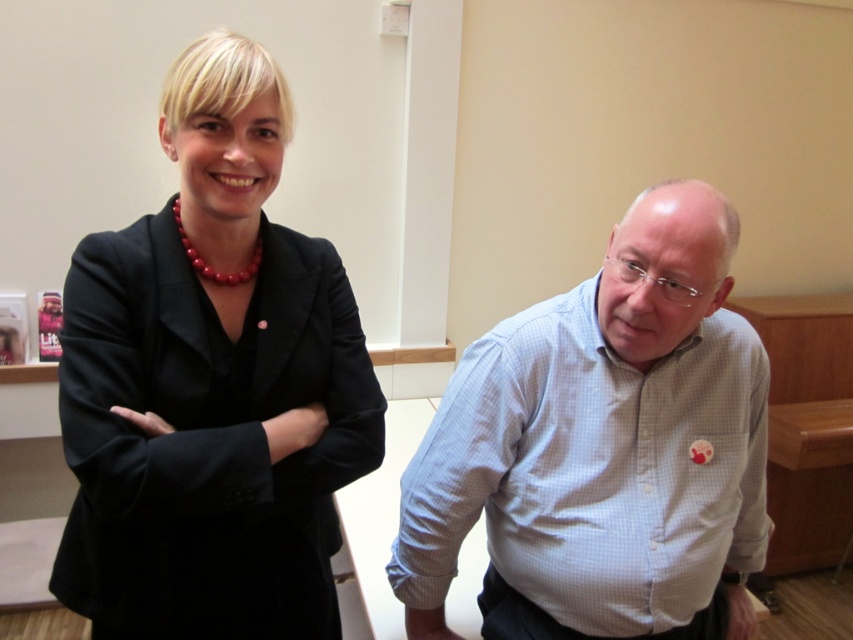
Does black matte blazer at upper left have a larger size compared to white checkered shirt at right?

Correct, black matte blazer at upper left is larger in size than white checkered shirt at right.

Is black matte blazer at upper left to the left of white checkered shirt at right from the viewer's perspective?

Indeed, black matte blazer at upper left is positioned on the left side of white checkered shirt at right.

Describe the element at coordinates (212, 385) in the screenshot. I see `black matte blazer at upper left` at that location.

You are a GUI agent. You are given a task and a screenshot of the screen. Output one action in this format:
    pyautogui.click(x=<x>, y=<y>)
    Task: Click on the black matte blazer at upper left
    This screenshot has width=853, height=640.
    Given the screenshot: What is the action you would take?
    pyautogui.click(x=212, y=385)

Can you confirm if black matte blazer at upper left is smaller than white checkered shirt at center?

Correct, black matte blazer at upper left occupies less space than white checkered shirt at center.

Can you confirm if black matte blazer at upper left is wider than white checkered shirt at center?

No.

Locate an element on the screen. This screenshot has width=853, height=640. black matte blazer at upper left is located at coordinates (212, 385).

At what (x,y) coordinates should I click in order to perform the action: click on black matte blazer at upper left. Please return your answer as a coordinate pair (x, y). The height and width of the screenshot is (640, 853). Looking at the image, I should click on (212, 385).

Is point (502, 458) closer to camera compared to point (416, 577)?

Yes, it is.

Is white checkered shirt at center taller than white checkered shirt at right?

Yes.

Does point (415, 566) lie behind point (415, 515)?

Yes, it is.

At what (x,y) coordinates should I click in order to perform the action: click on white checkered shirt at center. Please return your answer as a coordinate pair (x, y). Looking at the image, I should click on (601, 442).